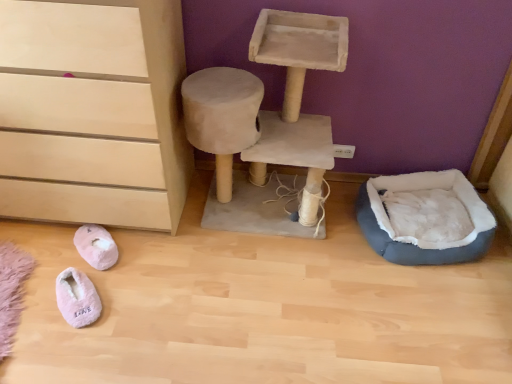
Measure the distance between point (75, 242) and camera.

A distance of 5.67 feet exists between point (75, 242) and camera.

This screenshot has height=384, width=512. I want to click on matte wood chest of drawers at lower left, so click(93, 112).

This screenshot has width=512, height=384. What are the coordinates of `gray plush pet bed at lower right` in the screenshot? It's located at (425, 218).

Identify the location of pink fluffy slippers at lower left, arranged as the 2th footwear when viewed from the back. The height and width of the screenshot is (384, 512). (77, 298).

Locate an element on the screen. The height and width of the screenshot is (384, 512). pink fuzzy slippers at lower left, the first footwear viewed from the back is located at coordinates (96, 246).

Is pink fluffy slippers at lower left, arranged as the 2th footwear when viewed from the back, not close to pink fuzzy slippers at lower left, the first footwear viewed from the back?

No, there isn't a large distance between pink fluffy slippers at lower left, arranged as the 2th footwear when viewed from the back, and pink fuzzy slippers at lower left, the first footwear viewed from the back.

Is pink fluffy slippers at lower left, which is the first footwear from front to back, bigger than pink fuzzy slippers at lower left, the second footwear in the front-to-back sequence?

Yes, pink fluffy slippers at lower left, which is the first footwear from front to back, is bigger than pink fuzzy slippers at lower left, the second footwear in the front-to-back sequence.

Who is more distant, pink fluffy slippers at lower left, arranged as the 2th footwear when viewed from the back, or pink fuzzy slippers at lower left, the second footwear in the front-to-back sequence?

pink fuzzy slippers at lower left, the second footwear in the front-to-back sequence, is behind.

Is pink fluffy slippers at lower left, which is the first footwear from front to back, shorter than pink fuzzy slippers at lower left, the first footwear viewed from the back?

Correct, pink fluffy slippers at lower left, which is the first footwear from front to back, is not as tall as pink fuzzy slippers at lower left, the first footwear viewed from the back.

How far apart are pink fluffy slippers at lower left, which is the first footwear from front to back, and matte wood chest of drawers at lower left?

pink fluffy slippers at lower left, which is the first footwear from front to back, is 20.71 inches from matte wood chest of drawers at lower left.

In the image, there is a pink fluffy slippers at lower left, which is the first footwear from front to back. Where is `the chest of drawers above it (from the image's perspective)`? The image size is (512, 384). the chest of drawers above it (from the image's perspective) is located at coordinates (93, 112).

From a real-world perspective, between pink fluffy slippers at lower left, which is the first footwear from front to back, and matte wood chest of drawers at lower left, who is vertically lower?

pink fluffy slippers at lower left, which is the first footwear from front to back, from a real-world perspective.

From the image's perspective, relative to matte wood chest of drawers at lower left, is pink fluffy slippers at lower left, which is the first footwear from front to back, above or below?

Clearly, from the image's perspective, pink fluffy slippers at lower left, which is the first footwear from front to back, is below matte wood chest of drawers at lower left.

Can you confirm if pink fuzzy slippers at lower left, the first footwear viewed from the back, is wider than matte wood chest of drawers at lower left?

No, pink fuzzy slippers at lower left, the first footwear viewed from the back, is not wider than matte wood chest of drawers at lower left.

Does pink fuzzy slippers at lower left, the second footwear in the front-to-back sequence, have a greater height compared to matte wood chest of drawers at lower left?

Incorrect, the height of pink fuzzy slippers at lower left, the second footwear in the front-to-back sequence, is not larger of that of matte wood chest of drawers at lower left.

Which is farther from the camera, [116,250] or [60,75]?

The point [116,250] is more distant.

From a real-world perspective, is pink fuzzy slippers at lower left, the second footwear in the front-to-back sequence, positioned above or below matte wood chest of drawers at lower left?

Clearly, from a real-world perspective, pink fuzzy slippers at lower left, the second footwear in the front-to-back sequence, is below matte wood chest of drawers at lower left.

Between gray plush pet bed at lower right and matte wood chest of drawers at lower left, which one appears on the right side from the viewer's perspective?

Positioned to the right is gray plush pet bed at lower right.

Is gray plush pet bed at lower right directly adjacent to matte wood chest of drawers at lower left?

gray plush pet bed at lower right is not next to matte wood chest of drawers at lower left, and they're not touching.

From a real-world perspective, is gray plush pet bed at lower right located beneath matte wood chest of drawers at lower left?

Yes, from a real-world perspective, gray plush pet bed at lower right is beneath matte wood chest of drawers at lower left.

How many degrees apart are the facing directions of gray plush pet bed at lower right and matte wood chest of drawers at lower left?

The facing directions of gray plush pet bed at lower right and matte wood chest of drawers at lower left are 13.1 degrees apart.

Does point (418, 256) lie behind point (87, 236)?

No, (418, 256) is closer to viewer.

Considering the relative sizes of gray plush pet bed at lower right and pink fuzzy slippers at lower left, the first footwear viewed from the back, in the image provided, is gray plush pet bed at lower right thinner than pink fuzzy slippers at lower left, the first footwear viewed from the back,?

In fact, gray plush pet bed at lower right might be wider than pink fuzzy slippers at lower left, the first footwear viewed from the back.

Considering the sizes of gray plush pet bed at lower right and pink fuzzy slippers at lower left, the first footwear viewed from the back, in the image, is gray plush pet bed at lower right taller or shorter than pink fuzzy slippers at lower left, the first footwear viewed from the back,?

Considering their sizes, gray plush pet bed at lower right has more height than pink fuzzy slippers at lower left, the first footwear viewed from the back.

From the image's perspective, is gray plush pet bed at lower right located beneath pink fuzzy slippers at lower left, the second footwear in the front-to-back sequence?

Actually, gray plush pet bed at lower right appears above pink fuzzy slippers at lower left, the second footwear in the front-to-back sequence, in the image.

How much distance is there between gray plush pet bed at lower right and pink fluffy slippers at lower left, which is the first footwear from front to back?

gray plush pet bed at lower right and pink fluffy slippers at lower left, which is the first footwear from front to back, are 4.34 feet apart from each other.

Considering the positions of point (373, 203) and point (80, 287), is point (373, 203) closer or farther from the camera than point (80, 287)?

Point (373, 203) appears to be farther away from the viewer than point (80, 287).

Does gray plush pet bed at lower right have a lesser width compared to pink fluffy slippers at lower left, arranged as the 2th footwear when viewed from the back?

No, gray plush pet bed at lower right is not thinner than pink fluffy slippers at lower left, arranged as the 2th footwear when viewed from the back.

Is matte wood chest of drawers at lower left facing towards pink fluffy slippers at lower left, arranged as the 2th footwear when viewed from the back?

Yes, matte wood chest of drawers at lower left is aimed at pink fluffy slippers at lower left, arranged as the 2th footwear when viewed from the back.

Is matte wood chest of drawers at lower left thinner than pink fluffy slippers at lower left, which is the first footwear from front to back?

In fact, matte wood chest of drawers at lower left might be wider than pink fluffy slippers at lower left, which is the first footwear from front to back.

What's the angular difference between matte wood chest of drawers at lower left and pink fluffy slippers at lower left, which is the first footwear from front to back,'s facing directions?

matte wood chest of drawers at lower left and pink fluffy slippers at lower left, which is the first footwear from front to back, are facing 41.2 degrees away from each other.

Considering the sizes of matte wood chest of drawers at lower left and pink fluffy slippers at lower left, which is the first footwear from front to back, in the image, is matte wood chest of drawers at lower left bigger or smaller than pink fluffy slippers at lower left, which is the first footwear from front to back,?

Clearly, matte wood chest of drawers at lower left is larger in size than pink fluffy slippers at lower left, which is the first footwear from front to back.

Locate an element on the screen. footwear behind the pink fluffy slippers at lower left, arranged as the 2th footwear when viewed from the back is located at coordinates (96, 246).

From a real-world perspective, count 2nd footwears downward from the matte wood chest of drawers at lower left and point to it. Please provide its 2D coordinates.

[(77, 298)]

Considering their positions, is gray plush pet bed at lower right positioned further to matte wood chest of drawers at lower left than pink fuzzy slippers at lower left, the first footwear viewed from the back?

gray plush pet bed at lower right lies further to matte wood chest of drawers at lower left than the other object.

From the image, which object appears to be farther from matte wood chest of drawers at lower left, pink fuzzy slippers at lower left, the first footwear viewed from the back, or pink fluffy slippers at lower left, which is the first footwear from front to back?

The object further to matte wood chest of drawers at lower left is pink fluffy slippers at lower left, which is the first footwear from front to back.

From the image, which object appears to be farther from gray plush pet bed at lower right, pink fluffy slippers at lower left, arranged as the 2th footwear when viewed from the back, or pink fuzzy slippers at lower left, the second footwear in the front-to-back sequence?

Based on the image, pink fluffy slippers at lower left, arranged as the 2th footwear when viewed from the back, appears to be further to gray plush pet bed at lower right.

Based on the photo, estimate the real-world distances between objects in this image. Which object is closer to gray plush pet bed at lower right, pink fuzzy slippers at lower left, the first footwear viewed from the back, or matte wood chest of drawers at lower left?

The object closer to gray plush pet bed at lower right is matte wood chest of drawers at lower left.

Which object lies further to the anchor point gray plush pet bed at lower right, matte wood chest of drawers at lower left or pink fluffy slippers at lower left, arranged as the 2th footwear when viewed from the back?

pink fluffy slippers at lower left, arranged as the 2th footwear when viewed from the back, lies further to gray plush pet bed at lower right than the other object.

Consider the image. Looking at the image, which one is located further to pink fuzzy slippers at lower left, the first footwear viewed from the back, pink fluffy slippers at lower left, arranged as the 2th footwear when viewed from the back, or matte wood chest of drawers at lower left?

matte wood chest of drawers at lower left is positioned further to the anchor pink fuzzy slippers at lower left, the first footwear viewed from the back.

Looking at the image, which one is located closer to matte wood chest of drawers at lower left, gray plush pet bed at lower right or pink fluffy slippers at lower left, arranged as the 2th footwear when viewed from the back?

Among the two, pink fluffy slippers at lower left, arranged as the 2th footwear when viewed from the back, is located nearer to matte wood chest of drawers at lower left.

Considering their positions, is pink fluffy slippers at lower left, which is the first footwear from front to back, positioned further to pink fuzzy slippers at lower left, the second footwear in the front-to-back sequence, than gray plush pet bed at lower right?

Among the two, gray plush pet bed at lower right is located further to pink fuzzy slippers at lower left, the second footwear in the front-to-back sequence.

The height and width of the screenshot is (384, 512). I want to click on footwear that lies between matte wood chest of drawers at lower left and pink fluffy slippers at lower left, which is the first footwear from front to back, from top to bottom, so click(x=96, y=246).

This screenshot has height=384, width=512. Find the location of `footwear between pink fuzzy slippers at lower left, the second footwear in the front-to-back sequence, and gray plush pet bed at lower right`. footwear between pink fuzzy slippers at lower left, the second footwear in the front-to-back sequence, and gray plush pet bed at lower right is located at coordinates (77, 298).